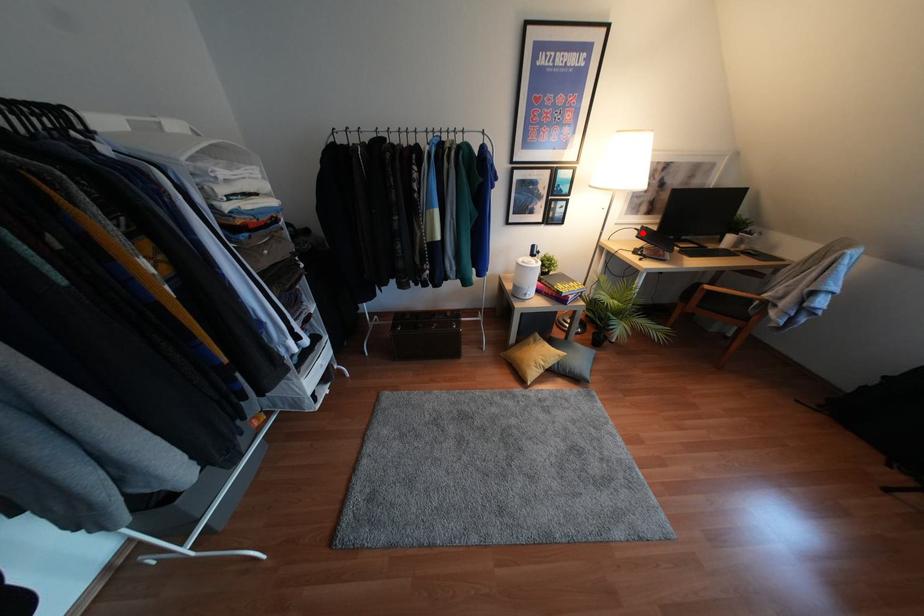
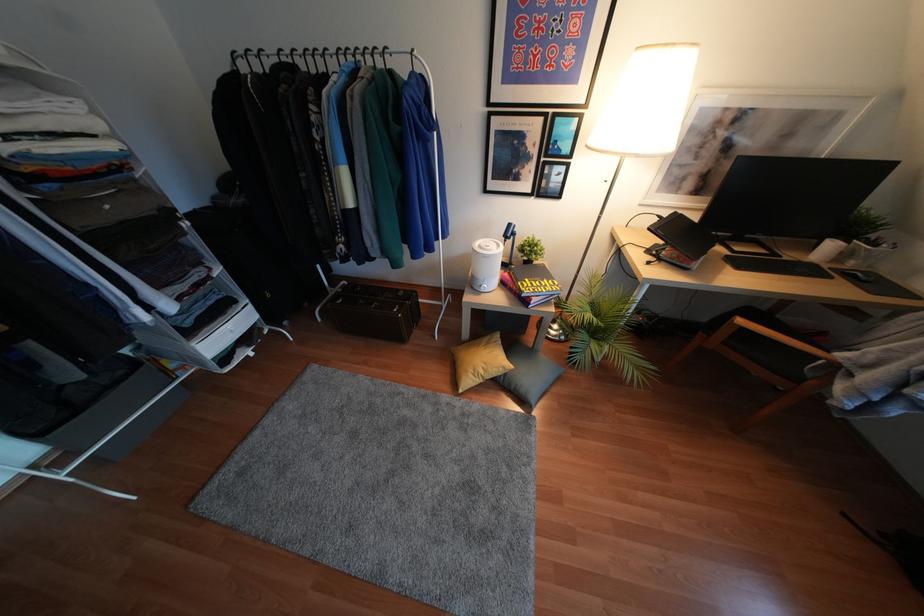
Question: I am providing you with two images of the same scene from different viewpoints. A red point is shown in image1. For the corresponding object point in image2, is it positioned nearer or farther from the camera?

Choices:
 (A) Nearer
 (B) Farther

Answer: (B)